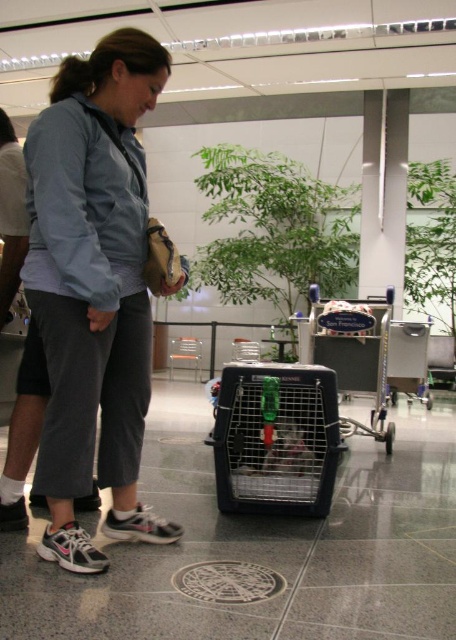
Question: Is black plastic pet carrier at center in front of metallic silver shopping cart at center?

Choices:
 (A) yes
 (B) no

Answer: (A)

Question: Can you confirm if black plastic pet carrier at center is positioned above metallic silver shopping cart at center?

Choices:
 (A) yes
 (B) no

Answer: (B)

Question: Which object is farther from the camera taking this photo?

Choices:
 (A) gray fabric pants at lower center
 (B) black plastic pet carrier at center
 (C) metallic silver shopping cart at center

Answer: (C)

Question: Which point is farther from the camera taking this photo?

Choices:
 (A) (374, 348)
 (B) (98, 342)
 (C) (255, 412)

Answer: (A)

Question: Which object is the closest to the metallic silver shopping cart at center?

Choices:
 (A) gray fabric pants at lower center
 (B) black plastic pet carrier at center

Answer: (B)

Question: Is gray fabric pants at lower center positioned behind black plastic pet carrier at center?

Choices:
 (A) no
 (B) yes

Answer: (A)